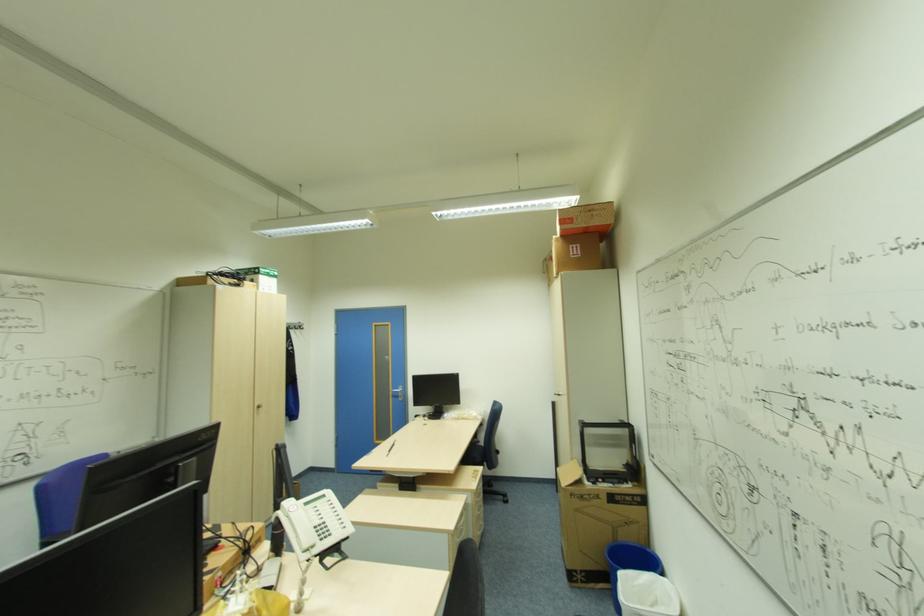
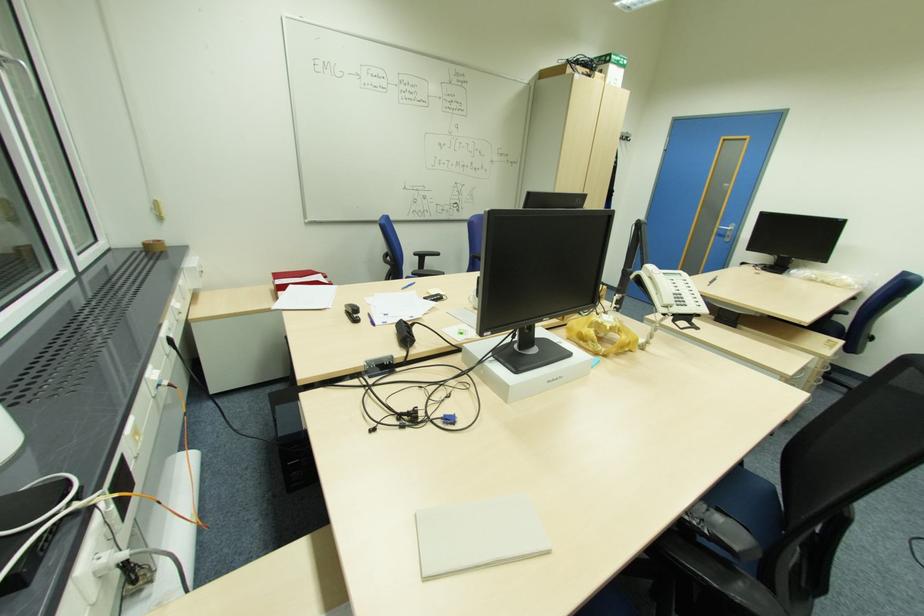
Locate, in the second image, the point that corresponds to the point at 324,540 in the first image.

(681, 305)